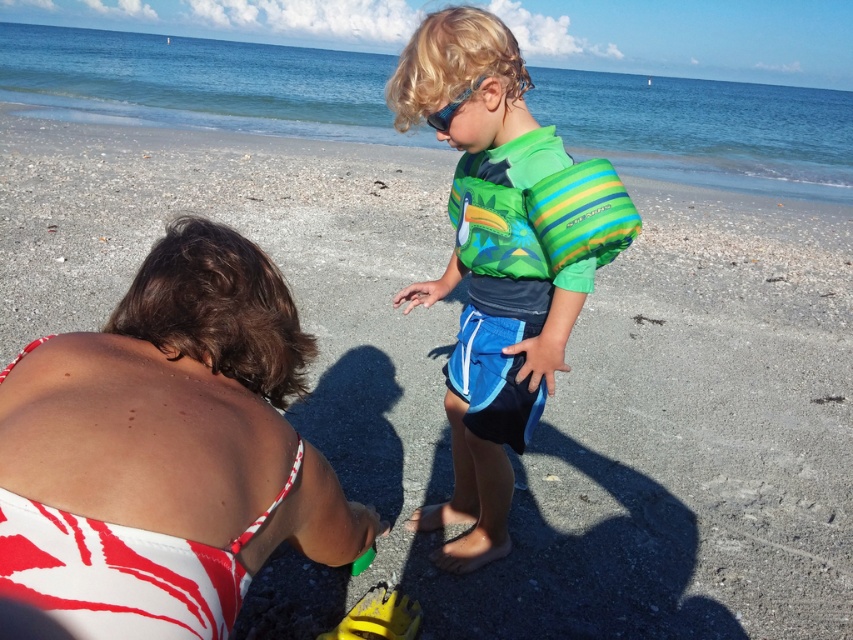
You are a photographer trying to capture a photo of the white printed swimsuit at lower left and the green striped life jacket at center. Which object should you focus on first if you want to highlight the larger one in your shot?

The white printed swimsuit at lower left is larger in size than the green striped life jacket at center, so you should focus on the white printed swimsuit at lower left first to highlight its larger size in the photo.

You are a photographer planning to take a group photo of the white printed swimsuit at lower left and the green striped life jacket at center. To ensure both are fully visible in the frame, which object should be positioned closer to the camera to avoid being cropped out?

The white printed swimsuit at lower left might be wider than the green striped life jacket at center, so positioning the white printed swimsuit at lower left closer to the camera would help ensure both are fully visible without cropping.

You are a photographer trying to capture the best shot of the two green items at the beach. The green matte swimsuit at center and the green striped life jacket at center are both in your frame. Which item should you focus on if you want to photograph the one that is lower in the image?

The green matte swimsuit at center is positioned under the green striped life jacket at center, so you should focus on the green matte swimsuit at center since it is lower in the image.